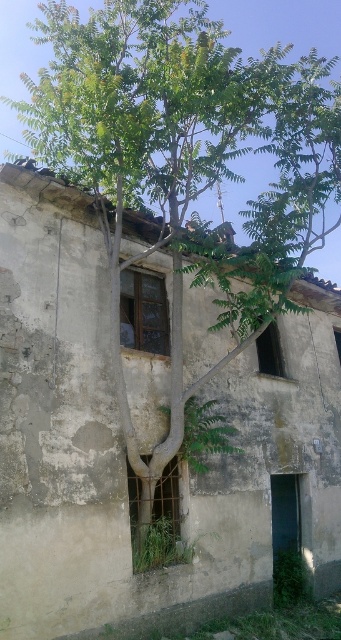
Based on the photo, which of these two, metallic wire mesh at center or dark glass window at center, stands taller?

metallic wire mesh at center

Can you confirm if metallic wire mesh at center is bigger than dark glass window at center?

Yes.

I want to click on metallic wire mesh at center, so click(155, 520).

Which is above, metallic wire mesh at center or wooden-framed window at center-left?

wooden-framed window at center-left is higher up.

Is metallic wire mesh at center below wooden-framed window at center-left?

Correct, metallic wire mesh at center is located below wooden-framed window at center-left.

Between point (136, 518) and point (140, 288), which one is positioned in front?

Point (136, 518)

Locate an element on the screen. metallic wire mesh at center is located at coordinates coord(155,520).

Consider the image. Does wooden-framed window at center-left appear under dark glass window at center?

Actually, wooden-framed window at center-left is above dark glass window at center.

Who is positioned more to the left, wooden-framed window at center-left or dark glass window at center?

wooden-framed window at center-left

Is point (144, 294) in front of point (264, 360)?

Yes.

Locate an element on the screen. The width and height of the screenshot is (341, 640). wooden-framed window at center-left is located at coordinates (142, 310).